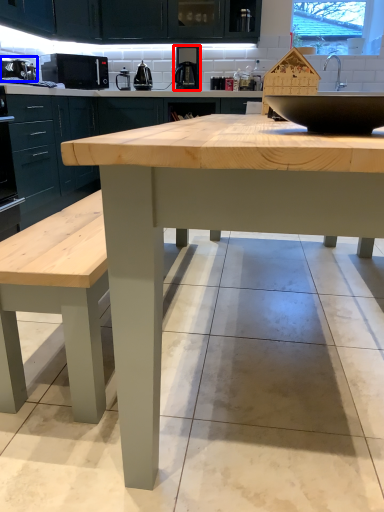
Question: Which object appears farthest to the camera in this image, coffee machine (highlighted by a red box) or appliance (highlighted by a blue box)?

Choices:
 (A) coffee machine
 (B) appliance

Answer: (A)